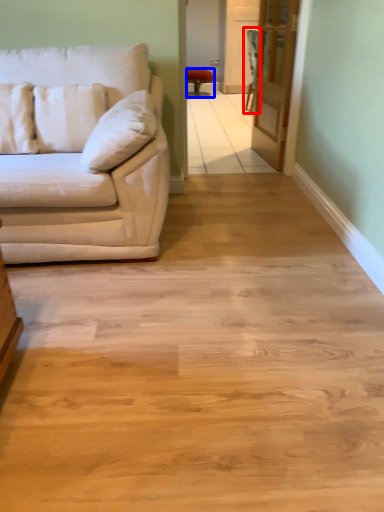
Question: Which object appears farthest to the camera in this image, armchair (highlighted by a red box) or chair (highlighted by a blue box)?

Choices:
 (A) armchair
 (B) chair

Answer: (B)